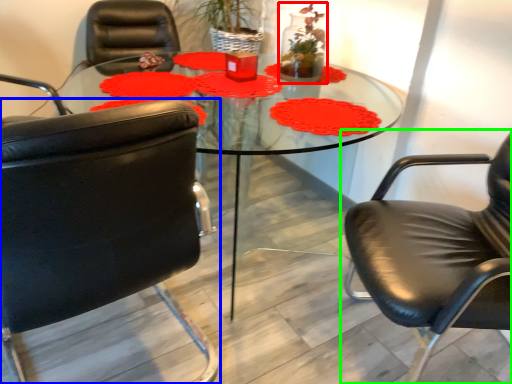
Question: Considering the real-world distances, which object is farthest from floral arrangement (highlighted by a red box)? chair (highlighted by a blue box) or chair (highlighted by a green box)?

Choices:
 (A) chair
 (B) chair

Answer: (A)